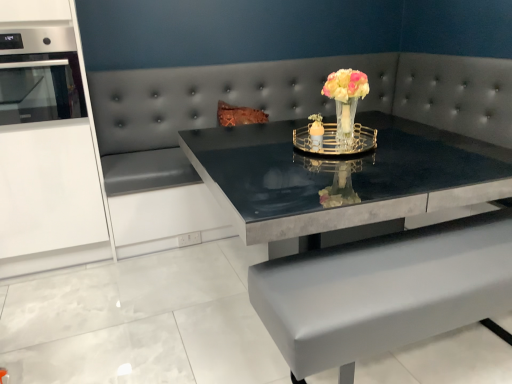
Question: Is stainless steel oven at left inside translucent glass vase at center?

Choices:
 (A) no
 (B) yes

Answer: (A)

Question: From a real-world perspective, is translucent glass vase at center physically above stainless steel oven at left?

Choices:
 (A) yes
 (B) no

Answer: (B)

Question: Is translucent glass vase at center shorter than stainless steel oven at left?

Choices:
 (A) no
 (B) yes

Answer: (B)

Question: Is translucent glass vase at center taller than stainless steel oven at left?

Choices:
 (A) no
 (B) yes

Answer: (A)

Question: Does translucent glass vase at center touch stainless steel oven at left?

Choices:
 (A) yes
 (B) no

Answer: (B)

Question: Is translucent glass vase at center positioned with its back to stainless steel oven at left?

Choices:
 (A) no
 (B) yes

Answer: (A)

Question: Considering the relative sizes of stainless steel oven at left and shiny black table at center in the image provided, is stainless steel oven at left shorter than shiny black table at center?

Choices:
 (A) yes
 (B) no

Answer: (A)

Question: Are stainless steel oven at left and shiny black table at center located far from each other?

Choices:
 (A) yes
 (B) no

Answer: (A)

Question: Does stainless steel oven at left lie behind shiny black table at center?

Choices:
 (A) yes
 (B) no

Answer: (A)

Question: Can you confirm if stainless steel oven at left is wider than shiny black table at center?

Choices:
 (A) yes
 (B) no

Answer: (B)

Question: Is shiny black table at center inside stainless steel oven at left?

Choices:
 (A) yes
 (B) no

Answer: (B)

Question: Could you tell me if stainless steel oven at left is facing shiny black table at center?

Choices:
 (A) yes
 (B) no

Answer: (B)

Question: Is shiny black table at center bigger than translucent glass vase at center?

Choices:
 (A) no
 (B) yes

Answer: (B)